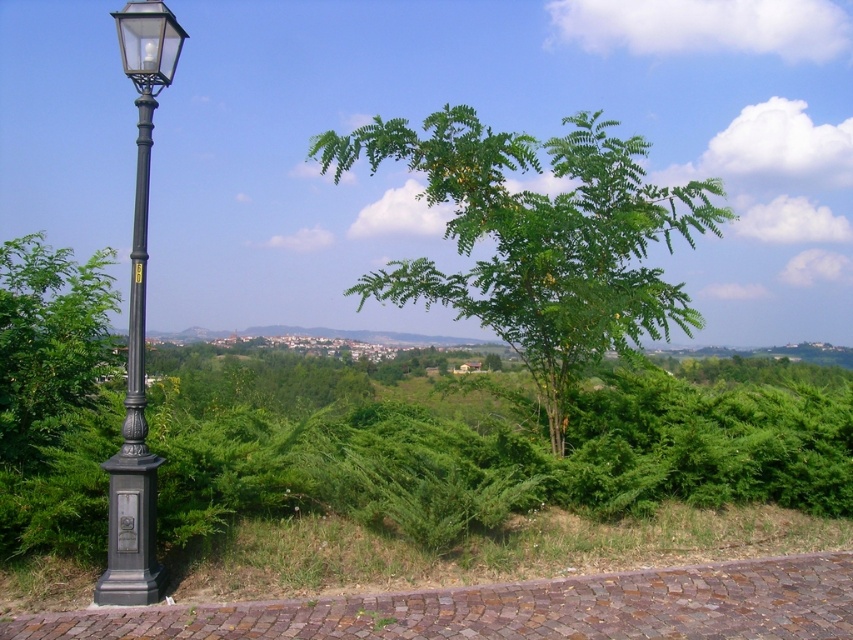
Is green leafy tree at center thinner than black metal/wooden lamp post at left?

In fact, green leafy tree at center might be wider than black metal/wooden lamp post at left.

Between green leafy tree at center and black metal/wooden lamp post at left, which one is positioned lower?

Positioned lower is black metal/wooden lamp post at left.

At what (x,y) coordinates should I click in order to perform the action: click on green leafy tree at center. Please return your answer as a coordinate pair (x, y). Looking at the image, I should click on (538, 237).